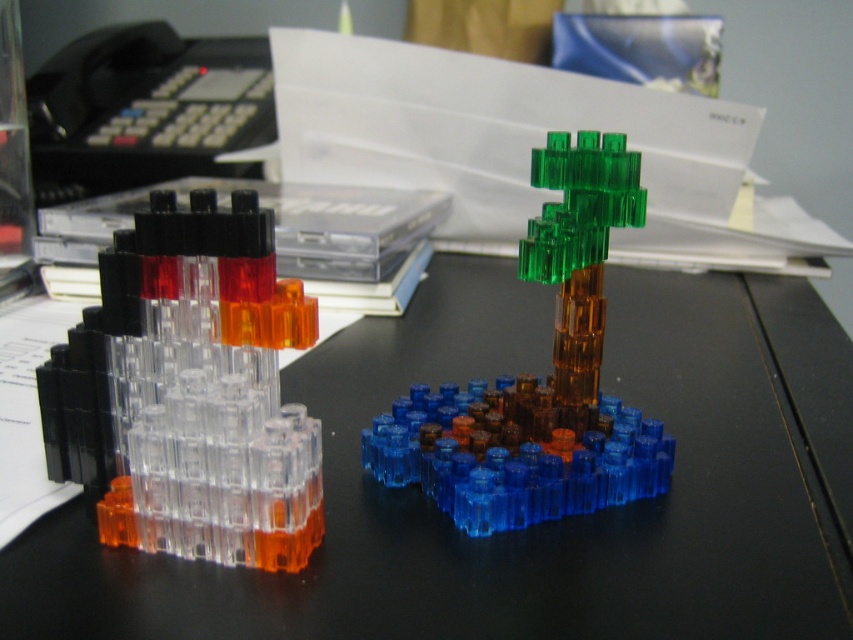
You are organizing a space theme party and need to decide which of the two items, the transparent plastic blocks at center or the transparent plastic rocket at left, can be used as a centerpiece that needs to be taller than 15 inches. Based on their sizes, which one should you choose?

The transparent plastic blocks at center is much taller than the transparent plastic rocket at left, so you should choose the transparent plastic blocks at center as the centerpiece since it meets the height requirement of being taller than 15 inches.

You are organizing a display for a toy store and need to place the transparent plastic rocket at left and the transparent plastic tree at center on a shelf. The shelf has a width of 40 cm. If the rocket is narrower than the tree, can both items fit side by side without overlapping?

The transparent plastic rocket at left is narrower than the transparent plastic tree at center. Since the rocket is narrower, both items can potentially fit side by side on the 40 cm shelf if their combined widths do not exceed 40 cm. However, the exact dimensions are needed to confirm.